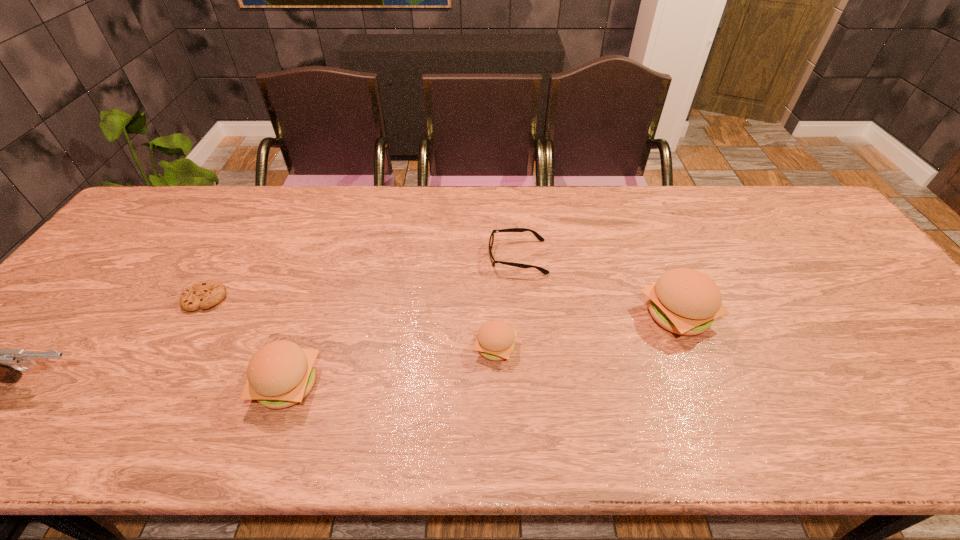
You are a GUI agent. You are given a task and a screenshot of the screen. Output one action in this format:
    pyautogui.click(x=<x>, y=<y>)
    Task: Click on the fourth object from right to left
    
    Given the screenshot: What is the action you would take?
    pyautogui.click(x=280, y=374)

What are the coordinates of `the second shortest hamburger` in the screenshot? It's located at (280, 374).

The height and width of the screenshot is (540, 960). What are the coordinates of `the shortest hamburger` in the screenshot? It's located at (495, 340).

Find the location of a particular element. the third shortest object is located at coordinates (495, 340).

At what (x,y) coordinates should I click in order to perform the action: click on the rightmost object. Please return your answer as a coordinate pair (x, y). The height and width of the screenshot is (540, 960). Looking at the image, I should click on (684, 301).

This screenshot has width=960, height=540. I want to click on spectacles, so click(540, 238).

Locate an element on the screen. This screenshot has width=960, height=540. the farthest object is located at coordinates (540, 238).

This screenshot has width=960, height=540. I want to click on the shortest object, so click(204, 294).

Find the location of a particular element. This screenshot has height=540, width=960. cookie is located at coordinates (204, 294).

Where is `free spot located 0.100m on the right of the third object from left to right`? free spot located 0.100m on the right of the third object from left to right is located at coordinates (362, 384).